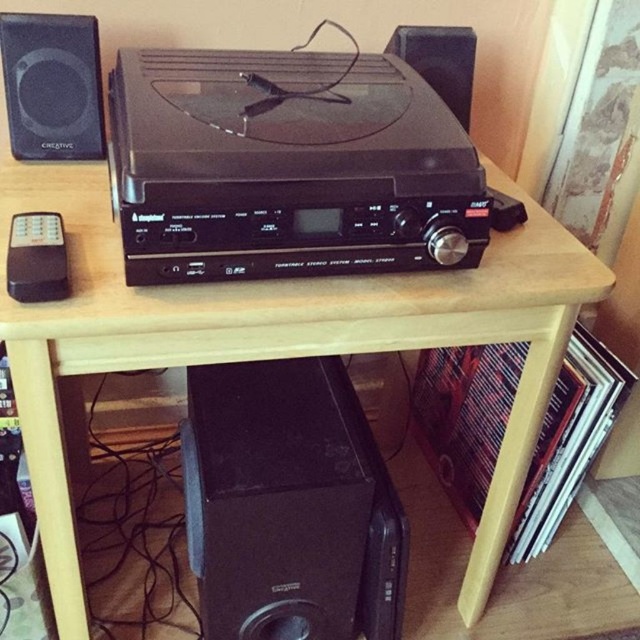
Between black plastic stereo at center and black matte speaker at upper center, which one appears on the right side from the viewer's perspective?

Positioned to the right is black matte speaker at upper center.

Does black plastic stereo at center have a lesser height compared to black matte speaker at upper center?

No.

You are a GUI agent. You are given a task and a screenshot of the screen. Output one action in this format:
    pyautogui.click(x=<x>, y=<y>)
    Task: Click on the black plastic stereo at center
    
    Given the screenshot: What is the action you would take?
    pyautogui.click(x=288, y=166)

At what (x,y) coordinates should I click in order to perform the action: click on black plastic stereo at center. Please return your answer as a coordinate pair (x, y). The width and height of the screenshot is (640, 640). Looking at the image, I should click on (288, 166).

Is point (227, 115) farther from viewer compared to point (38, 152)?

No, it is not.

Who is positioned more to the left, black plastic stereo at center or matte black speaker at upper left?

From the viewer's perspective, matte black speaker at upper left appears more on the left side.

This screenshot has width=640, height=640. What do you see at coordinates (288, 166) in the screenshot? I see `black plastic stereo at center` at bounding box center [288, 166].

Where is `black plastic stereo at center`? The height and width of the screenshot is (640, 640). black plastic stereo at center is located at coordinates (288, 166).

Does matte black speaker at upper left have a larger size compared to black matte speaker at upper center?

No.

Is point (20, 68) more distant than point (468, 81)?

No.

Where is `matte black speaker at upper left`? The width and height of the screenshot is (640, 640). matte black speaker at upper left is located at coordinates (52, 86).